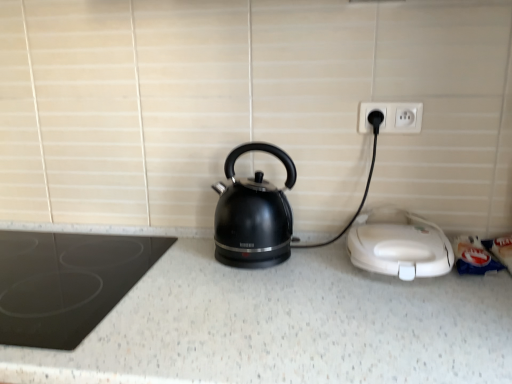
Question: Is white speckled granite at center far from black glass cooktop at left, placed as the first home appliance when sorted from left to right?

Choices:
 (A) no
 (B) yes

Answer: (A)

Question: Is white speckled granite at center at the right side of black glass cooktop at left, placed as the second home appliance when sorted from right to left?

Choices:
 (A) yes
 (B) no

Answer: (A)

Question: From the image's perspective, does white speckled granite at center appear lower than black glass cooktop at left, placed as the first home appliance when sorted from left to right?

Choices:
 (A) no
 (B) yes

Answer: (B)

Question: Can you confirm if white speckled granite at center is shorter than black glass cooktop at left, placed as the second home appliance when sorted from right to left?

Choices:
 (A) yes
 (B) no

Answer: (B)

Question: Is white speckled granite at center in front of black glass cooktop at left, placed as the first home appliance when sorted from left to right?

Choices:
 (A) no
 (B) yes

Answer: (B)

Question: Would you say white plastic sandwich maker at lower right, placed as the second home appliance when sorted from left to right, is inside or outside white plastic outlet at upper right?

Choices:
 (A) outside
 (B) inside

Answer: (A)

Question: From a real-world perspective, is white plastic sandwich maker at lower right, placed as the second home appliance when sorted from left to right, above or below white plastic outlet at upper right?

Choices:
 (A) above
 (B) below

Answer: (B)

Question: Looking at their shapes, would you say white plastic sandwich maker at lower right, placed as the second home appliance when sorted from left to right, is wider or thinner than white plastic outlet at upper right?

Choices:
 (A) wide
 (B) thin

Answer: (A)

Question: Is white plastic sandwich maker at lower right, which is the first home appliance in right-to-left order, to the left or to the right of white plastic outlet at upper right in the image?

Choices:
 (A) left
 (B) right

Answer: (B)

Question: From a real-world perspective, is white speckled granite at center positioned above or below black glossy kettle at center?

Choices:
 (A) above
 (B) below

Answer: (B)

Question: Based on their sizes in the image, would you say white speckled granite at center is bigger or smaller than black glossy kettle at center?

Choices:
 (A) small
 (B) big

Answer: (B)

Question: Is white speckled granite at center spatially inside black glossy kettle at center, or outside of it?

Choices:
 (A) outside
 (B) inside

Answer: (A)

Question: Is white speckled granite at center to the left or to the right of black glossy kettle at center in the image?

Choices:
 (A) left
 (B) right

Answer: (A)

Question: Does point (398, 117) appear closer or farther from the camera than point (402, 273)?

Choices:
 (A) closer
 (B) farther

Answer: (B)

Question: From a real-world perspective, is white plastic outlet at upper right positioned above or below white plastic sandwich maker at lower right, which is the first home appliance in right-to-left order?

Choices:
 (A) below
 (B) above

Answer: (B)